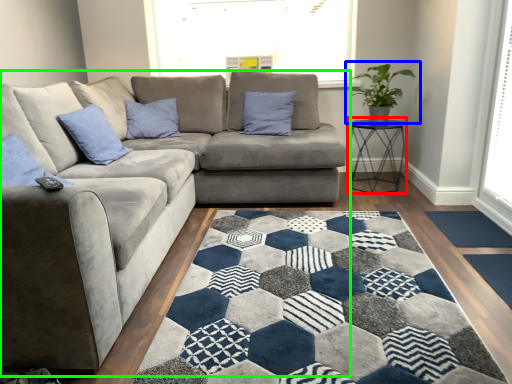
Question: Which object is the farthest from table (highlighted by a red box)? Choose among these: houseplant (highlighted by a blue box) or studio couch (highlighted by a green box).

Choices:
 (A) houseplant
 (B) studio couch

Answer: (B)